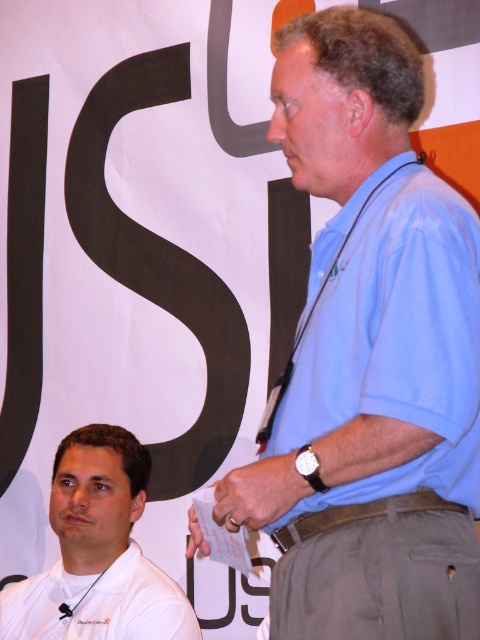
Question: Among these points, which one is farthest from the camera?

Choices:
 (A) (357, 278)
 (B) (113, 579)

Answer: (B)

Question: Where is light blue shirt at center located in relation to white matte dress shirt at lower left in the image?

Choices:
 (A) right
 (B) left

Answer: (A)

Question: Which point is closer to the camera?

Choices:
 (A) (171, 634)
 (B) (446, 316)
 (C) (79, 536)
 (D) (470, 358)

Answer: (B)

Question: Is light blue shirt at center wider than light blue cotton polo shirt at center?

Choices:
 (A) no
 (B) yes

Answer: (B)

Question: Among these points, which one is nearest to the camera?

Choices:
 (A) (22, 624)
 (B) (287, 86)
 (C) (84, 579)
 (D) (407, 474)

Answer: (D)

Question: Is light blue cotton polo shirt at center positioned behind white matte dress shirt at lower left?

Choices:
 (A) no
 (B) yes

Answer: (A)